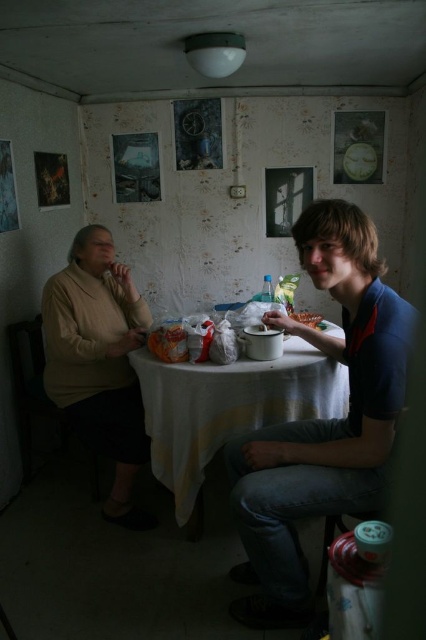
In the scene described, there are two objects of interest. The first is the blue cotton shirt at right, and the second is the white cloth table at center. If you were to compare their thickness, which object is thinner?

The blue cotton shirt at right is thinner than the white cloth table at center.

You are planning to place a new decorative item on the table. Based on the image, can you determine if the white cloth table at center has enough space to accommodate the white matte bowl at table center without overlapping?

The white cloth table at center might be wider than white matte bowl at table center, so there is a possibility that the table has sufficient space to place the bowl without overlapping. However, the exact dimensions are not provided, so it is uncertain.

You are a guest sitting at the white cloth table at center and you want to reach for the white matte bowl at table center. Is the bowl within your immediate reach without moving your chair?

The white cloth table at center is closer to the viewer than the white matte bowl at table center, so the bowl is farther away. Since you are sitting at the table, the bowl might be within arm reach depending on its distance, but based on the description, it is positioned further back on the table, so you may need to extend your arm or adjust your position slightly to reach it.